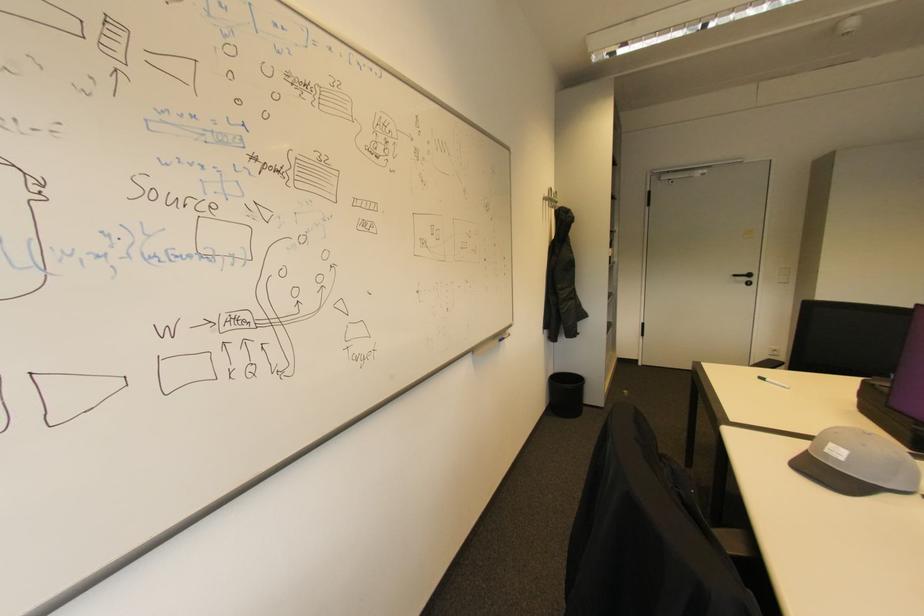
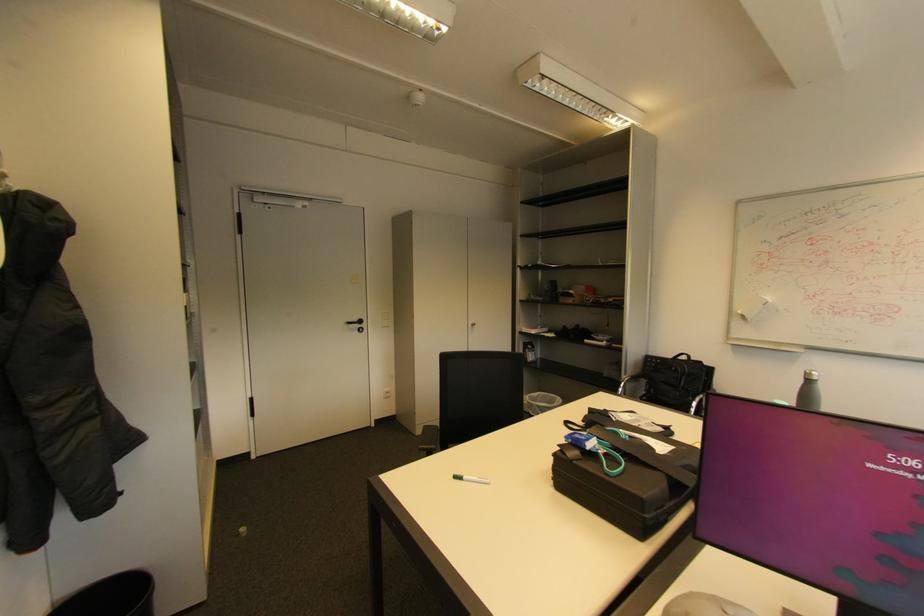
Find the pixel in the second image that matches the point at 871,383 in the first image.

(561, 456)